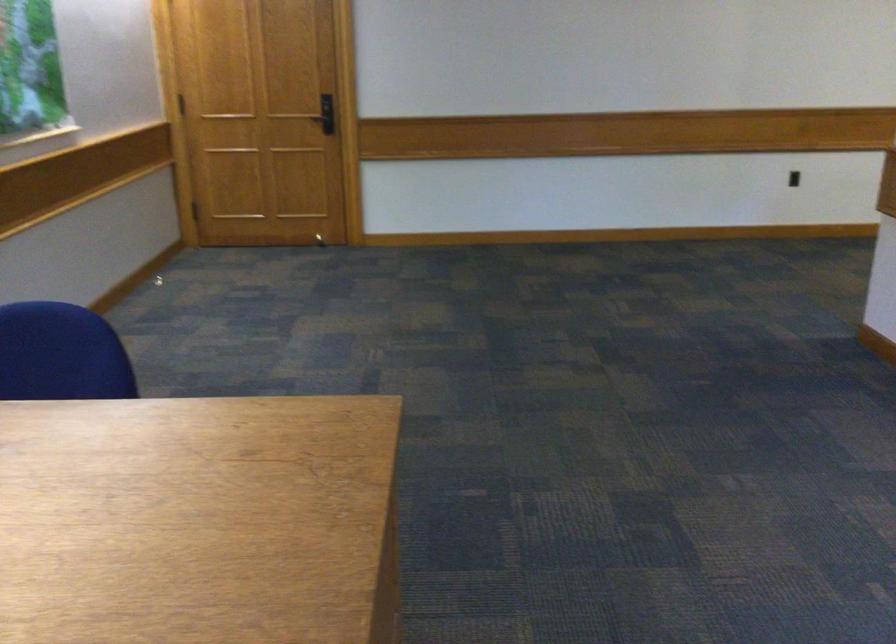
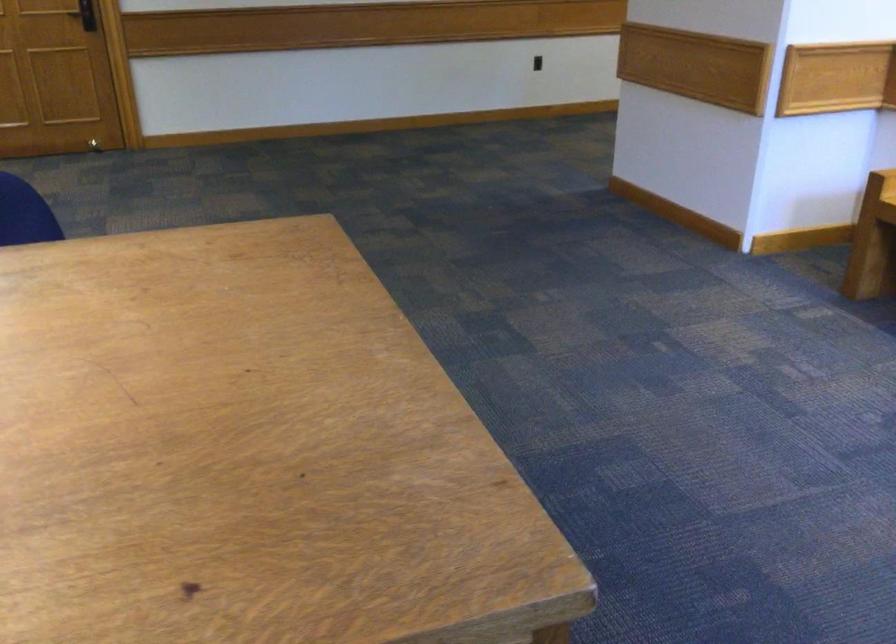
In a continuous first-person perspective shot, in which direction is the camera moving?

The cameraman moved toward left, backward.